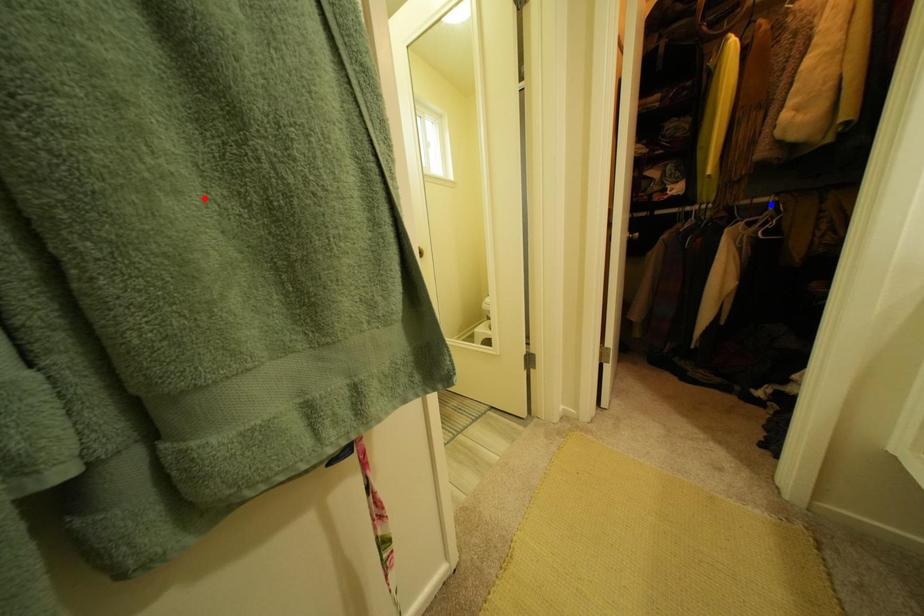
Question: Two points are marked on the image. Which point is closer to the camera?

Choices:
 (A) Blue point is closer.
 (B) Red point is closer.

Answer: (B)